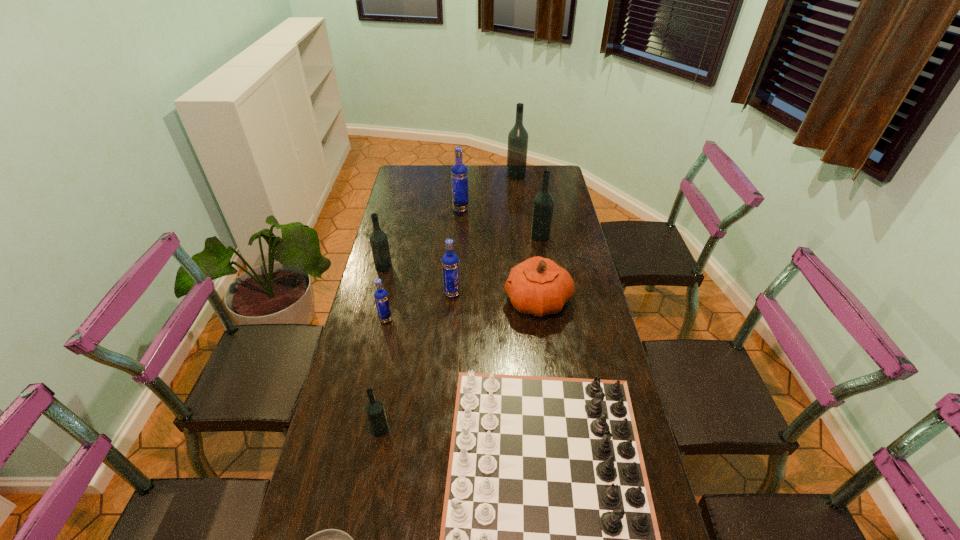
Locate an element on the screen. The height and width of the screenshot is (540, 960). vodka that can be found as the closest to the third smallest black vodka is located at coordinates (459, 173).

Find the location of a particular element. Image resolution: width=960 pixels, height=540 pixels. black vodka that is the third closest to the seventh nearest object is located at coordinates (518, 136).

Identify which black vodka is the nearest to the pumpkin. Please provide its 2D coordinates. Your answer should be formatted as a tuple, i.e. [(x, y)], where the tuple contains the x and y coordinates of a point satisfying the conditions above.

[(543, 203)]

Select which blue vodka appears as the second closest to the shortest object. Please provide its 2D coordinates. Your answer should be formatted as a tuple, i.e. [(x, y)], where the tuple contains the x and y coordinates of a point satisfying the conditions above.

[(450, 263)]

Choose which blue vodka is the nearest neighbor to the tallest vodka. Please provide its 2D coordinates. Your answer should be formatted as a tuple, i.e. [(x, y)], where the tuple contains the x and y coordinates of a point satisfying the conditions above.

[(459, 173)]